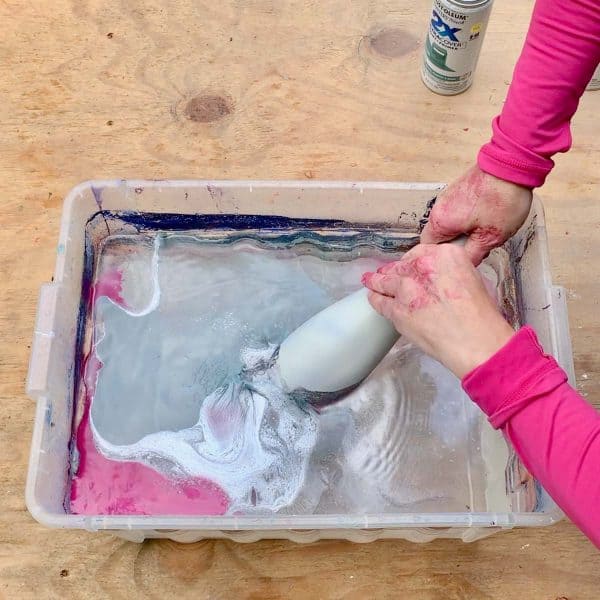
Identify the location of bottle. The height and width of the screenshot is (600, 600). (441, 62).